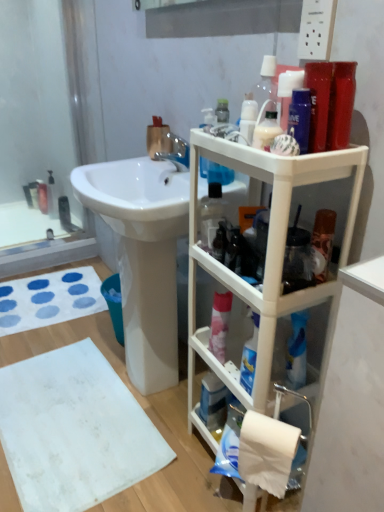
This screenshot has width=384, height=512. Identify the location of vacant space situated on the left part of white plastic shelf at right. (167, 477).